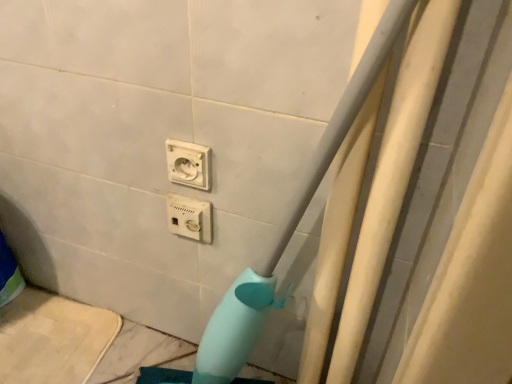
Question: Which direction should I rotate to look at white plastic power plugs and sockets at center, the 1th power plugs and sockets positioned from the bottom, — up or down?

Choices:
 (A) up
 (B) down

Answer: (B)

Question: Does white plastic socket at center, which ranks as the 2th power plugs and sockets in bottom-to-top order, have a greater width compared to white plastic power plugs and sockets at center, the 2th power plugs and sockets positioned from the top?

Choices:
 (A) yes
 (B) no

Answer: (B)

Question: Is white plastic socket at center, placed as the 1th power plugs and sockets when sorted from top to bottom, placed right next to white plastic power plugs and sockets at center, the 1th power plugs and sockets positioned from the bottom?

Choices:
 (A) yes
 (B) no

Answer: (A)

Question: Is white plastic socket at center, placed as the 1th power plugs and sockets when sorted from top to bottom, looking in the opposite direction of white plastic power plugs and sockets at center, the 1th power plugs and sockets positioned from the bottom?

Choices:
 (A) yes
 (B) no

Answer: (B)

Question: Is the position of white plastic socket at center, placed as the 1th power plugs and sockets when sorted from top to bottom, more distant than that of white plastic power plugs and sockets at center, the 2th power plugs and sockets positioned from the top?

Choices:
 (A) yes
 (B) no

Answer: (B)

Question: Does white plastic socket at center, which ranks as the 2th power plugs and sockets in bottom-to-top order, turn towards white plastic power plugs and sockets at center, the 1th power plugs and sockets positioned from the bottom?

Choices:
 (A) yes
 (B) no

Answer: (B)

Question: Is white plastic socket at center, which ranks as the 2th power plugs and sockets in bottom-to-top order, in front of white plastic power plugs and sockets at center, the 2th power plugs and sockets positioned from the top?

Choices:
 (A) yes
 (B) no

Answer: (A)

Question: From a real-world perspective, is white plastic power plugs and sockets at center, the 2th power plugs and sockets positioned from the top, beneath white plastic socket at center, placed as the 1th power plugs and sockets when sorted from top to bottom?

Choices:
 (A) yes
 (B) no

Answer: (A)

Question: Is white plastic power plugs and sockets at center, the 2th power plugs and sockets positioned from the top, taller than white plastic socket at center, which ranks as the 2th power plugs and sockets in bottom-to-top order?

Choices:
 (A) no
 (B) yes

Answer: (B)

Question: Is white plastic power plugs and sockets at center, the 1th power plugs and sockets positioned from the bottom, outside white plastic socket at center, which ranks as the 2th power plugs and sockets in bottom-to-top order?

Choices:
 (A) yes
 (B) no

Answer: (A)

Question: From the image's perspective, does white plastic power plugs and sockets at center, the 2th power plugs and sockets positioned from the top, appear lower than white plastic socket at center, which ranks as the 2th power plugs and sockets in bottom-to-top order?

Choices:
 (A) no
 (B) yes

Answer: (B)

Question: From the image's perspective, is white plastic power plugs and sockets at center, the 1th power plugs and sockets positioned from the bottom, on white plastic socket at center, placed as the 1th power plugs and sockets when sorted from top to bottom?

Choices:
 (A) yes
 (B) no

Answer: (B)

Question: Considering the relative sizes of white plastic power plugs and sockets at center, the 1th power plugs and sockets positioned from the bottom, and white plastic socket at center, which ranks as the 2th power plugs and sockets in bottom-to-top order, in the image provided, is white plastic power plugs and sockets at center, the 1th power plugs and sockets positioned from the bottom, thinner than white plastic socket at center, which ranks as the 2th power plugs and sockets in bottom-to-top order,?

Choices:
 (A) no
 (B) yes

Answer: (A)

Question: Is white plastic socket at center, which ranks as the 2th power plugs and sockets in bottom-to-top order, in front of or behind white plastic power plugs and sockets at center, the 2th power plugs and sockets positioned from the top, in the image?

Choices:
 (A) front
 (B) behind

Answer: (A)